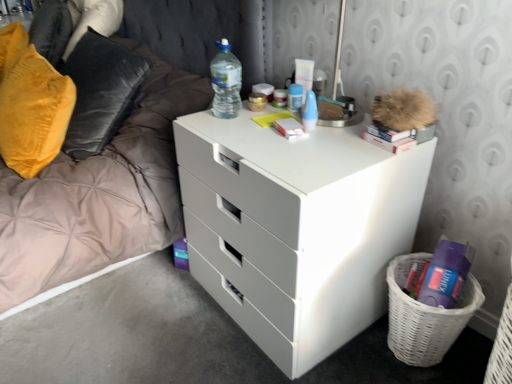
Locate an element on the screen. Image resolution: width=512 pixels, height=384 pixels. free spot in front of white plastic tube at upper center, positioned as the 1th toiletry in back-to-front order is located at coordinates (287, 116).